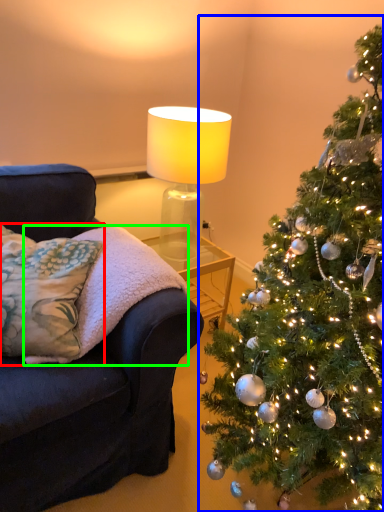
Question: Which object is the closest to the pillow (highlighted by a red box)? Choose among these: christmas tree (highlighted by a blue box) or blanket (highlighted by a green box).

Choices:
 (A) christmas tree
 (B) blanket

Answer: (B)